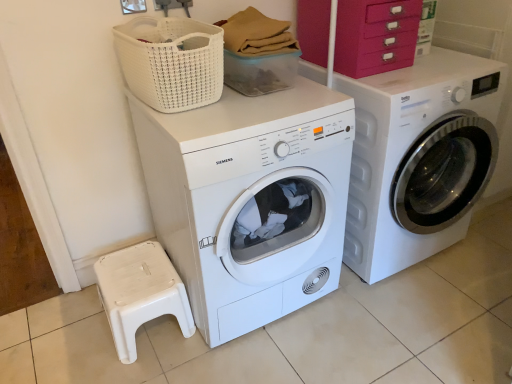
This screenshot has width=512, height=384. I want to click on free space above white matte washing machine at center, which is counted as the second washing machine, starting from the right (from a real-world perspective), so click(x=256, y=102).